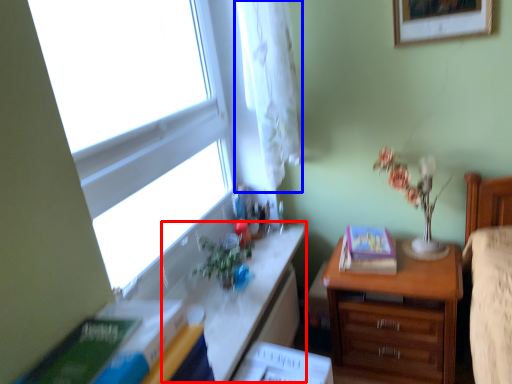
Question: Which of the following is the farthest to the observer, table (highlighted by a red box) or curtain (highlighted by a blue box)?

Choices:
 (A) table
 (B) curtain

Answer: (B)